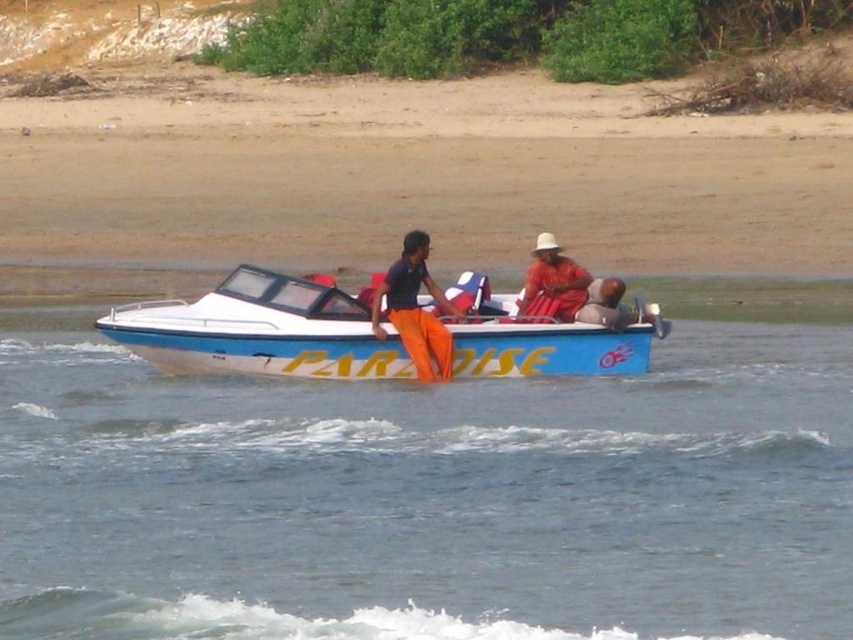
Which is behind, point (582, 465) or point (637, 356)?

Point (637, 356)

Between blue plastic boat at center and blue glossy boat at center, which one is positioned higher?

blue glossy boat at center

Which is in front, point (0, 616) or point (107, 333)?

Positioned in front is point (0, 616).

I want to click on blue plastic boat at center, so click(x=431, y=497).

Which is more to the right, blue glossy boat at center or orange matte pants at center?

orange matte pants at center

Does blue glossy boat at center have a greater width compared to orange matte pants at center?

Indeed, blue glossy boat at center has a greater width compared to orange matte pants at center.

The width and height of the screenshot is (853, 640). I want to click on blue glossy boat at center, so [260, 330].

You are a GUI agent. You are given a task and a screenshot of the screen. Output one action in this format:
    pyautogui.click(x=<x>, y=<y>)
    Task: Click on the blue glossy boat at center
    The image size is (853, 640).
    Given the screenshot: What is the action you would take?
    pyautogui.click(x=260, y=330)

Can you confirm if orange matte pants at center is smaller than orange fabric at center?

No, orange matte pants at center is not smaller than orange fabric at center.

Between point (416, 317) and point (527, 296), which one is positioned behind?

Point (527, 296)

What do you see at coordinates (415, 310) in the screenshot? I see `orange matte pants at center` at bounding box center [415, 310].

The image size is (853, 640). I want to click on orange matte pants at center, so click(x=415, y=310).